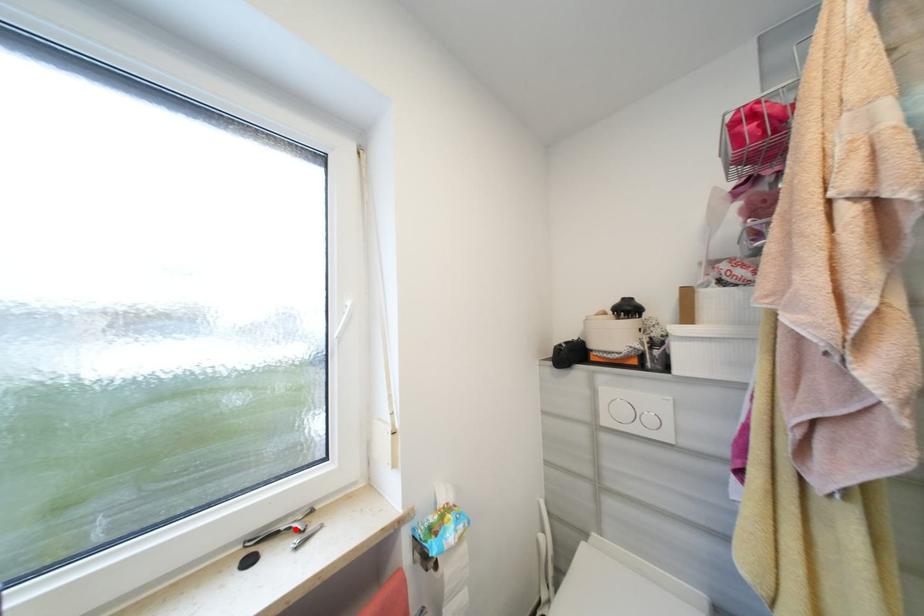
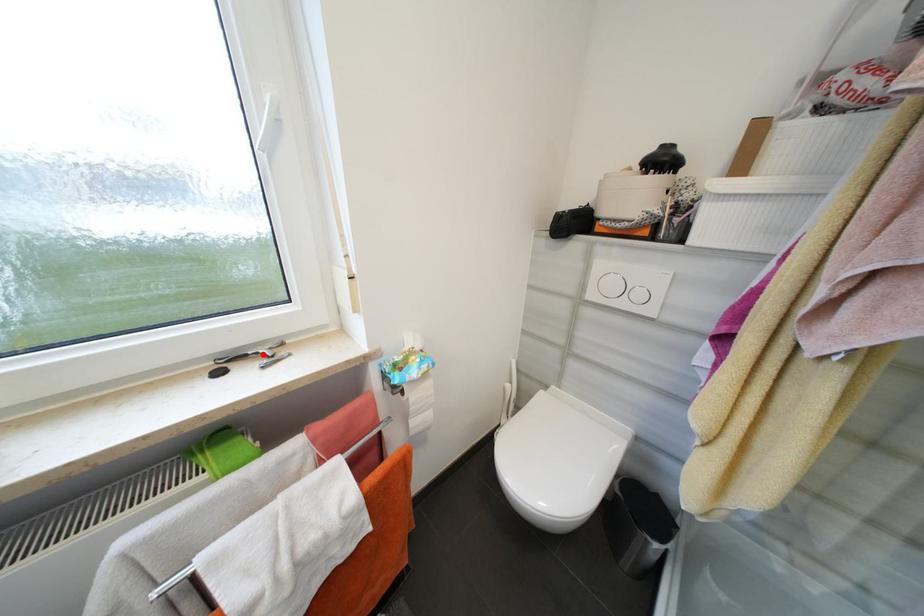
I am providing you with two images of the same scene from different viewpoints. A red point is marked on the first image and another point is marked on the second image. Do the highlighted points in image1 and image2 indicate the same real-world spot?

Yes